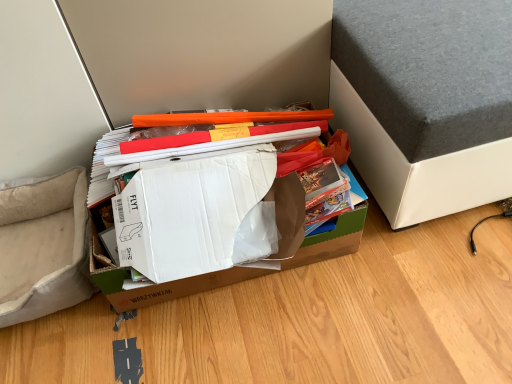
Find the location of a particular element. This screenshot has width=512, height=384. brown cardboard box at center is located at coordinates (155, 284).

In the image, is brown cardboard box at center positioned in front of or behind beige fabric armchair at lower left?

brown cardboard box at center is in front of beige fabric armchair at lower left.

Looking at this image, considering the sizes of objects brown cardboard box at center and beige fabric armchair at lower left in the image provided, who is wider, brown cardboard box at center or beige fabric armchair at lower left?

brown cardboard box at center.

How much distance is there between brown cardboard box at center and beige fabric armchair at lower left?

A distance of 23.93 centimeters exists between brown cardboard box at center and beige fabric armchair at lower left.

Considering the relative sizes of brown cardboard box at center and beige fabric armchair at lower left in the image provided, is brown cardboard box at center taller than beige fabric armchair at lower left?

Correct, brown cardboard box at center is much taller as beige fabric armchair at lower left.

Where is `furniture above the beige fabric armchair at lower left (from the image's perspective)`? Image resolution: width=512 pixels, height=384 pixels. furniture above the beige fabric armchair at lower left (from the image's perspective) is located at coordinates (425, 102).

From the image's perspective, is beige fabric armchair at lower left below gray fabric bed at upper right?

Correct, beige fabric armchair at lower left appears lower than gray fabric bed at upper right in the image.

Between beige fabric armchair at lower left and gray fabric bed at upper right, which one has less height?

With less height is beige fabric armchair at lower left.

Considering the relative sizes of beige fabric armchair at lower left and gray fabric bed at upper right in the image provided, is beige fabric armchair at lower left smaller than gray fabric bed at upper right?

Yes, beige fabric armchair at lower left is smaller than gray fabric bed at upper right.

Consider the image. From the image's perspective, which is below, brown cardboard box at center or gray fabric bed at upper right?

From the image's view, brown cardboard box at center is below.

Where is `cardboard box that is on the left side of gray fabric bed at upper right`? The width and height of the screenshot is (512, 384). cardboard box that is on the left side of gray fabric bed at upper right is located at coordinates (155, 284).

Which of these two, gray fabric bed at upper right or beige fabric armchair at lower left, is wider?

With larger width is gray fabric bed at upper right.

How different are the orientations of gray fabric bed at upper right and beige fabric armchair at lower left in degrees?

The angle between the facing direction of gray fabric bed at upper right and the facing direction of beige fabric armchair at lower left is 1.15 degrees.

Looking at the image, does gray fabric bed at upper right seem bigger or smaller compared to beige fabric armchair at lower left?

Considering their sizes, gray fabric bed at upper right takes up more space than beige fabric armchair at lower left.

From the image's perspective, relative to beige fabric armchair at lower left, is gray fabric bed at upper right above or below?

gray fabric bed at upper right is situated higher than beige fabric armchair at lower left in the image.

Based on the photo, from the image's perspective, is gray fabric bed at upper right positioned above or below brown cardboard box at center?

From the image's perspective, gray fabric bed at upper right appears above brown cardboard box at center.

From a real-world perspective, is gray fabric bed at upper right under brown cardboard box at center?

No, from a real-world perspective, gray fabric bed at upper right is not beneath brown cardboard box at center.

Looking at this image, is gray fabric bed at upper right turned away from brown cardboard box at center?

That's not correct — gray fabric bed at upper right is not looking away from brown cardboard box at center.

Considering the relative positions of gray fabric bed at upper right and brown cardboard box at center in the image provided, is gray fabric bed at upper right to the left of brown cardboard box at center from the viewer's perspective?

No, gray fabric bed at upper right is not to the left of brown cardboard box at center.

Consider the image. From a real-world perspective, is beige fabric armchair at lower left positioned under brown cardboard box at center based on gravity?

Correct, in the physical world, beige fabric armchair at lower left is lower than brown cardboard box at center.

Which is in front, point (41, 293) or point (141, 289)?

The point (141, 289) is in front.

Where is `armchair behind the brown cardboard box at center`? armchair behind the brown cardboard box at center is located at coordinates (44, 247).

Is beige fabric armchair at lower left aimed at brown cardboard box at center?

No.

At what (x,y) coordinates should I click in order to perform the action: click on armchair lying behind the brown cardboard box at center. Please return your answer as a coordinate pair (x, y). Looking at the image, I should click on (44, 247).

This screenshot has height=384, width=512. Identify the location of furniture that is in front of the beige fabric armchair at lower left. (425, 102).

Which object lies further to the anchor point brown cardboard box at center, beige fabric armchair at lower left or gray fabric bed at upper right?

gray fabric bed at upper right is further to brown cardboard box at center.

Based on their spatial positions, is gray fabric bed at upper right or beige fabric armchair at lower left further from brown cardboard box at center?

gray fabric bed at upper right.

When comparing their distances from beige fabric armchair at lower left, does gray fabric bed at upper right or brown cardboard box at center seem closer?

Based on the image, brown cardboard box at center appears to be nearer to beige fabric armchair at lower left.

In the scene shown: Considering their positions, is brown cardboard box at center positioned further to gray fabric bed at upper right than beige fabric armchair at lower left?

Among the two, beige fabric armchair at lower left is located further to gray fabric bed at upper right.

From the image, which object appears to be farther from beige fabric armchair at lower left, brown cardboard box at center or gray fabric bed at upper right?

Among the two, gray fabric bed at upper right is located further to beige fabric armchair at lower left.

Looking at the image, which one is located closer to gray fabric bed at upper right, beige fabric armchair at lower left or brown cardboard box at center?

Among the two, brown cardboard box at center is located nearer to gray fabric bed at upper right.

Identify the location of cardboard box situated between beige fabric armchair at lower left and gray fabric bed at upper right from left to right. (155, 284).